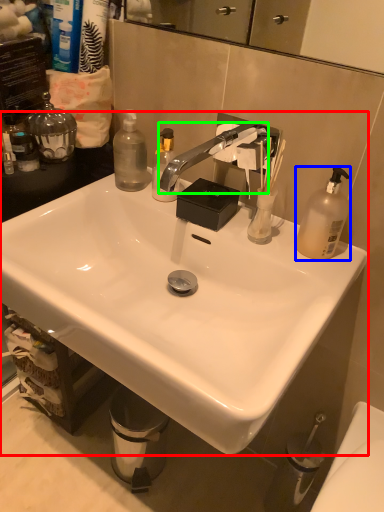
Question: Which object is the farthest from sink (highlighted by a red box)? Choose among these: bottle (highlighted by a blue box) or faucet (highlighted by a green box).

Choices:
 (A) bottle
 (B) faucet

Answer: (A)